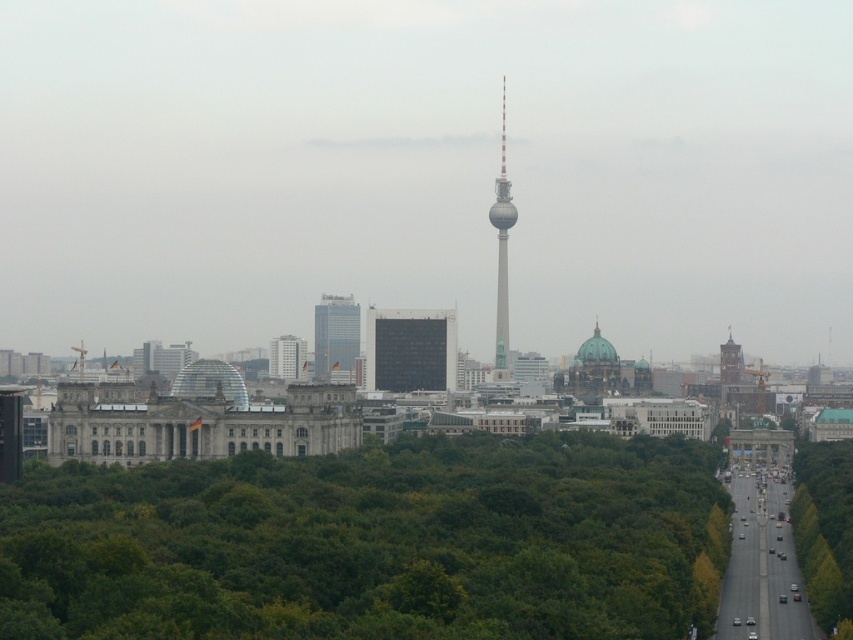
Looking at this image, you are an architect evaluating the Berlin skyline. You notice two structures labeled as matte glass skyscraper at center and matte glass building at center. Which one has a greater width?

The matte glass skyscraper at center is wider than the matte glass building at center according to the description.

You are a tourist standing in the middle of the road in Berlin, looking at the green leafy trees at center and the matte glass building at center. Which object is closer to the ground?

The green leafy trees at center is below matte glass building at center, so the green leafy trees at center is closer to the ground.

You are a tourist standing in the middle of the Berlin city park. You see the green leafy trees at center and the matte glass building at center. Which object takes up more space in your view?

The green leafy trees at center is larger in size than the matte glass building at center, so the green leafy trees at center takes up more space in your view.